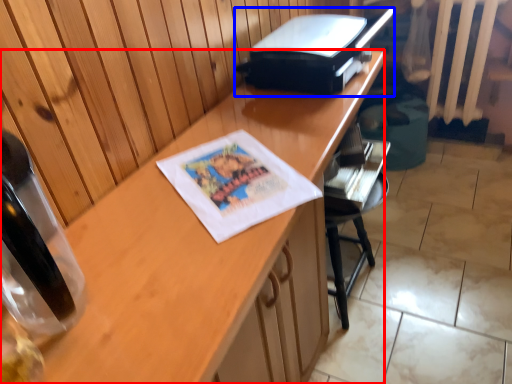
Question: Which of the following is the farthest to the observer, desk (highlighted by a red box) or printer (highlighted by a blue box)?

Choices:
 (A) desk
 (B) printer

Answer: (B)